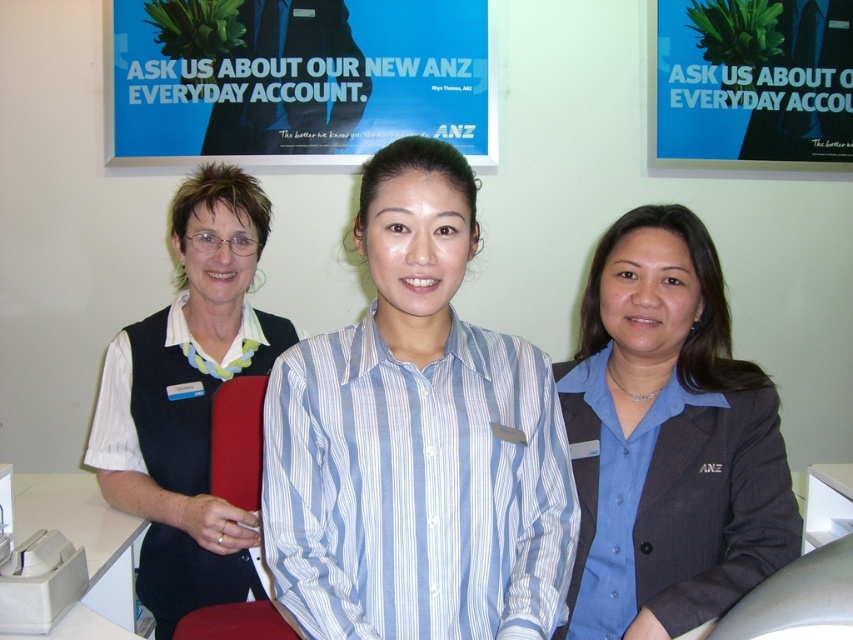
Who is positioned more to the left, blue striped shirt at center or blue textured blazer at center?

From the viewer's perspective, blue striped shirt at center appears more on the left side.

Is blue striped shirt at center smaller than blue textured blazer at center?

Indeed, blue striped shirt at center has a smaller size compared to blue textured blazer at center.

This screenshot has height=640, width=853. What do you see at coordinates (416, 440) in the screenshot?
I see `blue striped shirt at center` at bounding box center [416, 440].

The width and height of the screenshot is (853, 640). I want to click on blue striped shirt at center, so click(416, 440).

Which is in front, point (463, 81) or point (834, 476)?

Point (834, 476)

Is blue paper poster at upper center bigger than white plastic table at center?

Yes.

Find the location of a particular element. Image resolution: width=853 pixels, height=640 pixels. blue paper poster at upper center is located at coordinates (294, 80).

Image resolution: width=853 pixels, height=640 pixels. What do you see at coordinates (416, 440) in the screenshot?
I see `blue striped shirt at center` at bounding box center [416, 440].

Is blue striped shirt at center above white plastic table at center?

Indeed, blue striped shirt at center is positioned over white plastic table at center.

Which is in front, point (434, 276) or point (817, 500)?

Point (434, 276)

Where is `blue striped shirt at center`? blue striped shirt at center is located at coordinates (416, 440).